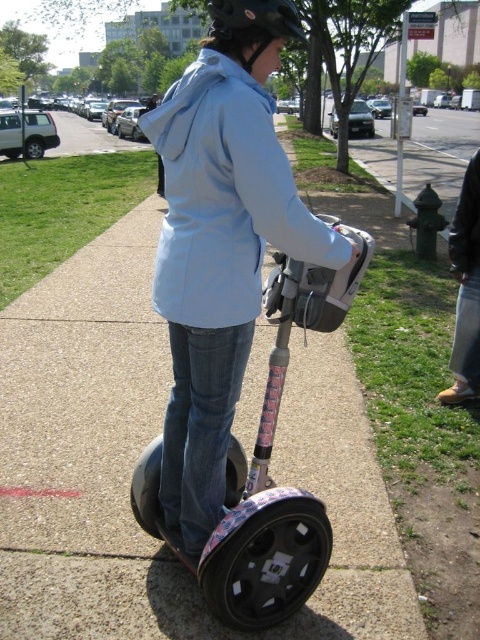
A person is riding a Segway on a sidewalk. The Segway has a pink and white frame and black wheels. The person is wearing a light blue jacket and a black helmet. There is a point at coordinates point (x=260, y=624). How far apart are the Segway and the point?

The Segway and the point are 2.07 meters apart.

You are a delivery person needing to secure a package on your metallic pink scooter at center. The package requires a hook that must be attached above the light blue fabric sweatshirt at center. Can you safely attach the hook above the sweatshirt without it interfering with the scooter?

The light blue fabric sweatshirt at center is shorter than the metallic pink scooter at center, so the hook can be safely attached above the sweatshirt without interfering with the scooter.

You are standing on the sidewalk and want to take a photo of the light blue fabric sweatshirt at center and the metallic pink scooter at center. Which object should you focus on first to ensure both are in the frame?

You should focus on the light blue fabric sweatshirt at center first because it is closer to the viewer than the metallic pink scooter at center, ensuring both are in the frame.